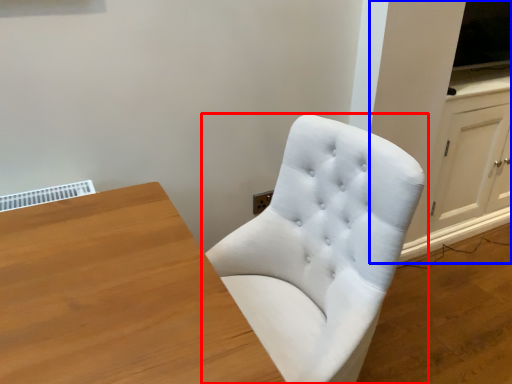
Question: Among these objects, which one is nearest to the camera, chair (highlighted by a red box) or dresser (highlighted by a blue box)?

Choices:
 (A) chair
 (B) dresser

Answer: (A)